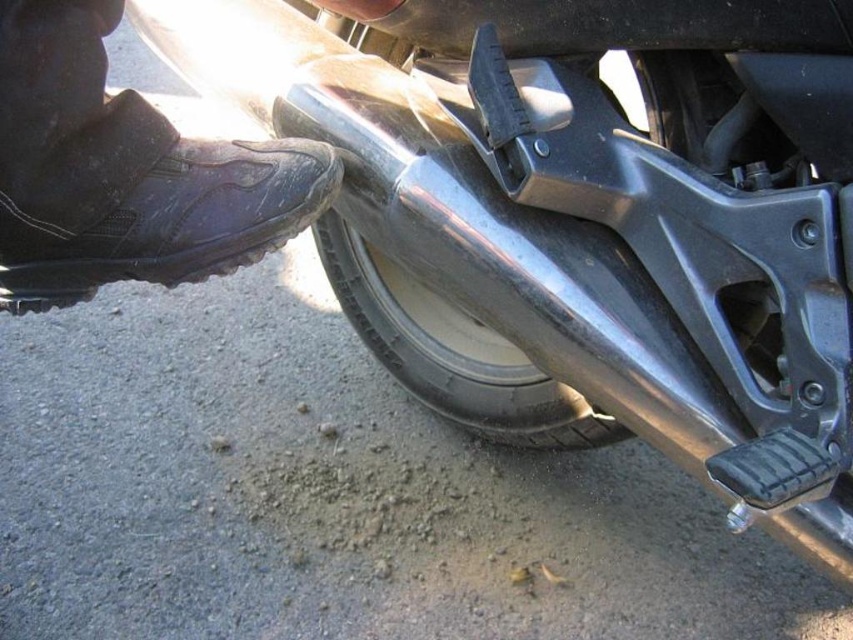
Question: Can you confirm if black leather boot at lower left is bigger than shiny metallic tire at lower center?

Choices:
 (A) yes
 (B) no

Answer: (B)

Question: Which point appears farthest from the camera in this image?

Choices:
 (A) (177, 138)
 (B) (381, 333)

Answer: (B)

Question: Which of the following is the farthest from the observer?

Choices:
 (A) black leather boot at lower left
 (B) shiny metallic tire at lower center

Answer: (B)

Question: Which point is farther to the camera?

Choices:
 (A) (463, 406)
 (B) (194, 198)

Answer: (A)

Question: Is black leather boot at lower left to the right of shiny metallic tire at lower center from the viewer's perspective?

Choices:
 (A) no
 (B) yes

Answer: (A)

Question: Does black leather boot at lower left lie in front of shiny metallic tire at lower center?

Choices:
 (A) no
 (B) yes

Answer: (B)